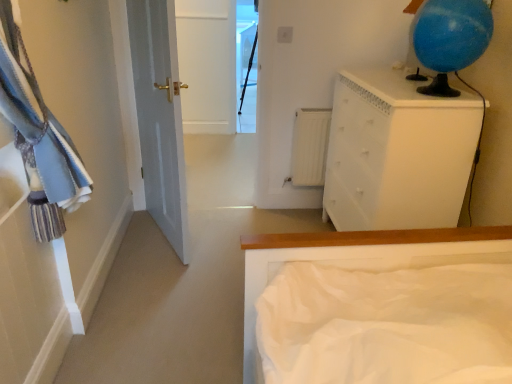
Question: From the image's perspective, is blue fabric laundry at left located above transparent glass window at center?

Choices:
 (A) no
 (B) yes

Answer: (A)

Question: Is blue fabric laundry at left not inside transparent glass window at center?

Choices:
 (A) yes
 (B) no

Answer: (A)

Question: From the image's perspective, is blue fabric laundry at left below transparent glass window at center?

Choices:
 (A) yes
 (B) no

Answer: (A)

Question: Is blue fabric laundry at left oriented towards transparent glass window at center?

Choices:
 (A) no
 (B) yes

Answer: (A)

Question: Is blue fabric laundry at left turned away from transparent glass window at center?

Choices:
 (A) yes
 (B) no

Answer: (B)

Question: Is blue fabric laundry at left inside the boundaries of white matte radiator at center, or outside?

Choices:
 (A) outside
 (B) inside

Answer: (A)

Question: Based on their sizes in the image, would you say blue fabric laundry at left is bigger or smaller than white matte radiator at center?

Choices:
 (A) big
 (B) small

Answer: (A)

Question: From their relative heights in the image, would you say blue fabric laundry at left is taller or shorter than white matte radiator at center?

Choices:
 (A) short
 (B) tall

Answer: (B)

Question: Is blue fabric laundry at left wider or thinner than white matte radiator at center?

Choices:
 (A) wide
 (B) thin

Answer: (A)

Question: Is white matte bed at center inside or outside of blue fabric laundry at left?

Choices:
 (A) outside
 (B) inside

Answer: (A)

Question: In terms of width, does white matte bed at center look wider or thinner when compared to blue fabric laundry at left?

Choices:
 (A) wide
 (B) thin

Answer: (A)

Question: Considering the positions of white matte bed at center and blue fabric laundry at left in the image, is white matte bed at center taller or shorter than blue fabric laundry at left?

Choices:
 (A) short
 (B) tall

Answer: (B)

Question: Considering the relative positions of white matte bed at center and blue fabric laundry at left in the image provided, is white matte bed at center to the left or to the right of blue fabric laundry at left?

Choices:
 (A) right
 (B) left

Answer: (A)

Question: From the image's perspective, is transparent glass window at center located above or below white painted wood chest of drawers at upper right?

Choices:
 (A) below
 (B) above

Answer: (B)

Question: Do you think transparent glass window at center is within white painted wood chest of drawers at upper right, or outside of it?

Choices:
 (A) inside
 (B) outside

Answer: (B)